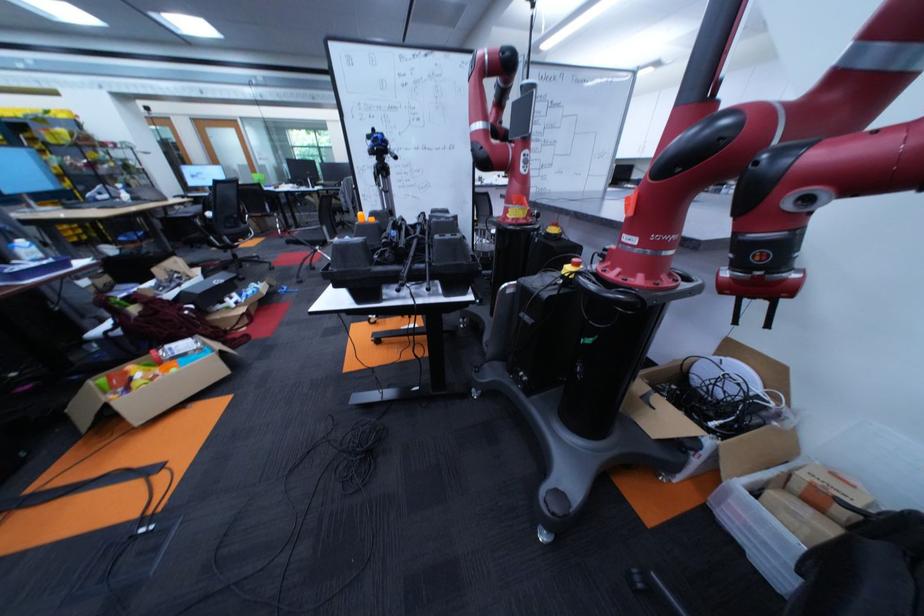
Locate an element on the screen. Image resolution: width=924 pixels, height=616 pixels. chair sitting surface is located at coordinates (227, 222).